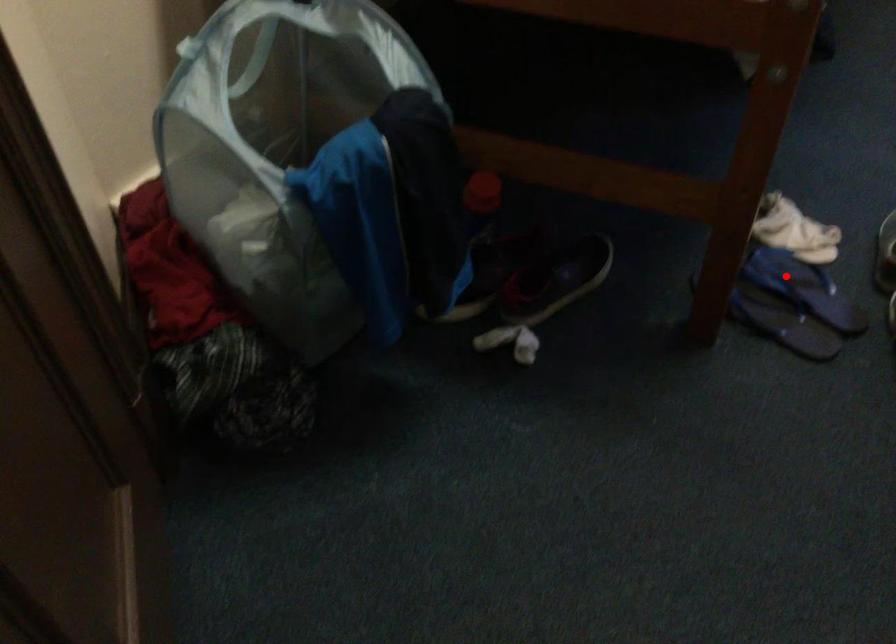
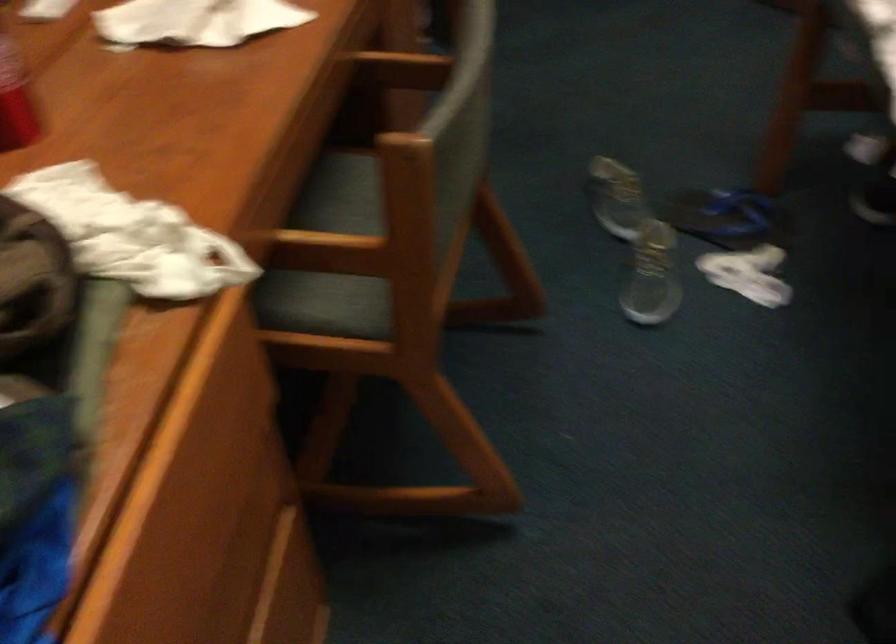
Find the pixel in the second image that matches the highlighted location in the first image.

(728, 218)